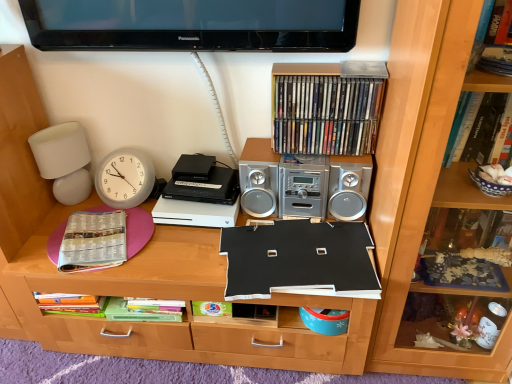
Question: Would you say black plastic cassette at center is inside or outside white paper at left, acting as the 1th paperback book starting from the left?

Choices:
 (A) outside
 (B) inside

Answer: (A)

Question: Is point (182, 177) positioned closer to the camera than point (123, 244)?

Choices:
 (A) farther
 (B) closer

Answer: (A)

Question: Which object is the closest to the white paper at left, the 2th paperback book positioned from the right?

Choices:
 (A) black matte paper at center, the second paperback book from the left
 (B) wooden bookcase at right
 (C) silver metallic stereo at upper center
 (D) white matte table lamp at left
 (E) black matte board at center

Answer: (E)

Question: Estimate the real-world distances between objects in this image. Which object is farther from the hardcover books at upper center?

Choices:
 (A) wooden bookcase at right
 (B) black plastic cassette at center
 (C) silver metallic stereo at upper center
 (D) black matte board at center
 (E) white paper at left, acting as the 1th paperback book starting from the left

Answer: (E)